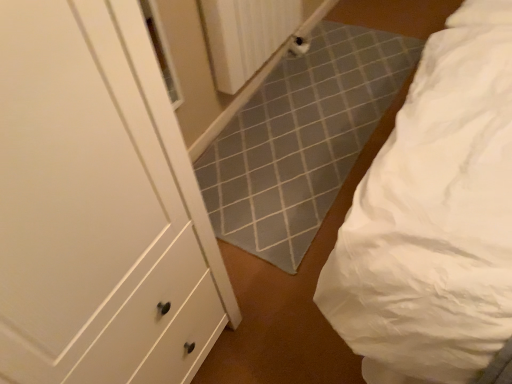
Locate an element on the screen. The height and width of the screenshot is (384, 512). white plastic radiator at upper center is located at coordinates (246, 36).

What do you see at coordinates (246, 36) in the screenshot?
I see `white plastic radiator at upper center` at bounding box center [246, 36].

Where is `white plastic radiator at upper center`? The width and height of the screenshot is (512, 384). white plastic radiator at upper center is located at coordinates (x=246, y=36).